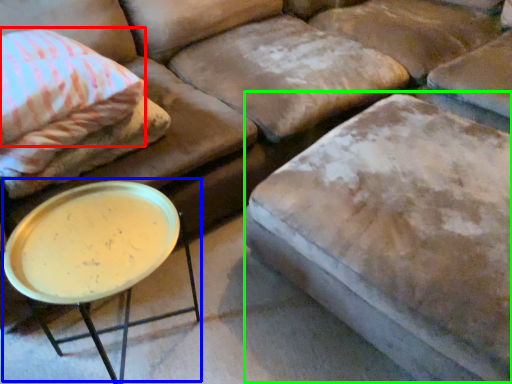
Question: Which object is the farthest from pillow (highlighted by a red box)? Choose among these: round table (highlighted by a blue box) or swivel chair (highlighted by a green box).

Choices:
 (A) round table
 (B) swivel chair

Answer: (B)